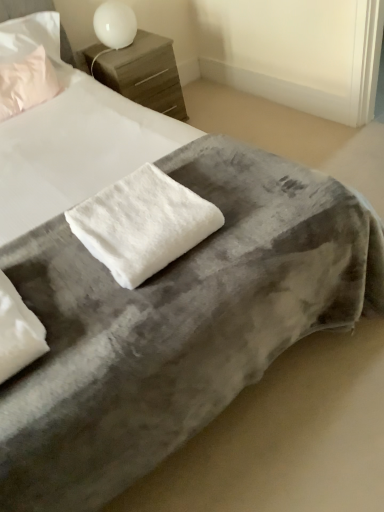
At what (x,y) coordinates should I click in order to perform the action: click on free point to the right of white fluffy pillow at lower left, the second pillow in the top-to-bottom sequence. Please return your answer as a coordinate pair (x, y). The image size is (384, 512). Looking at the image, I should click on (78, 306).